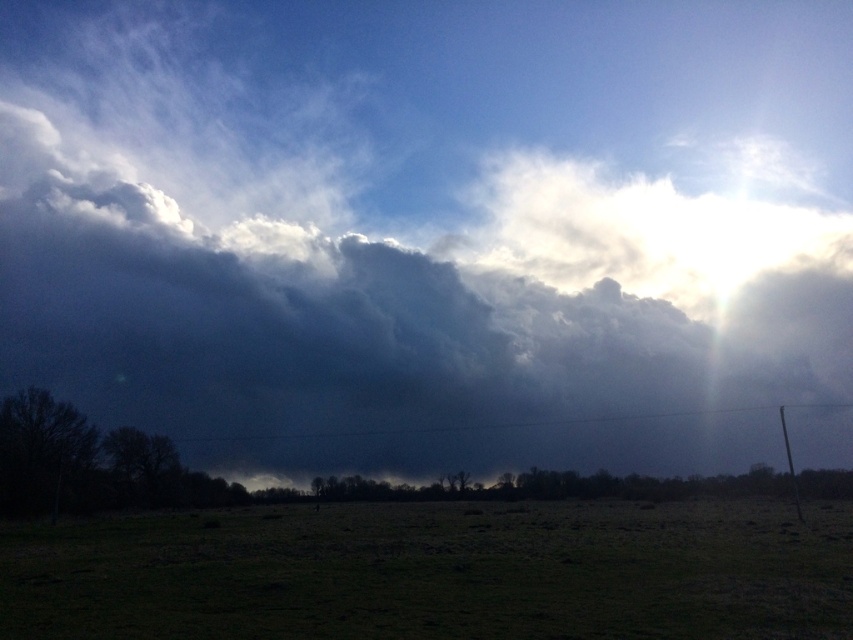
Question: In this image, where is dark gray cloud at upper center located relative to green grass at lower center?

Choices:
 (A) above
 (B) below

Answer: (A)

Question: Which of the following is the farthest from the observer?

Choices:
 (A) dark gray cloud at upper center
 (B) green grass at lower center

Answer: (A)

Question: Among these objects, which one is nearest to the camera?

Choices:
 (A) dark gray cloud at upper center
 (B) green grass at lower center

Answer: (B)

Question: Does dark gray cloud at upper center have a smaller size compared to green grass at lower center?

Choices:
 (A) no
 (B) yes

Answer: (A)

Question: Is dark gray cloud at upper center to the right of green grass at lower center from the viewer's perspective?

Choices:
 (A) no
 (B) yes

Answer: (A)